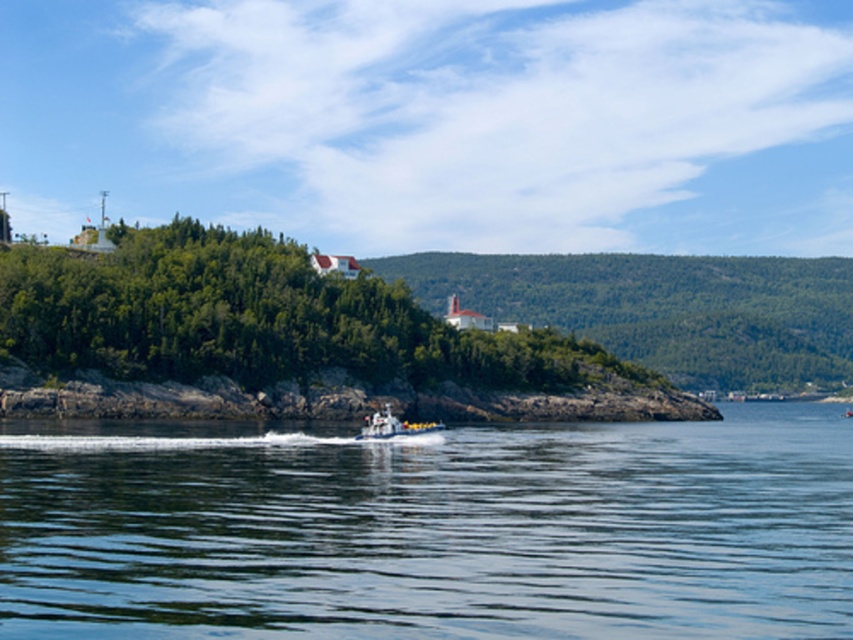
Question: Observing the image, what is the correct spatial positioning of clear blue water at center in reference to metallic gray boat at center?

Choices:
 (A) below
 (B) above

Answer: (A)

Question: Which point is closer to the camera?

Choices:
 (A) metallic gray boat at center
 (B) clear blue water at center

Answer: (B)

Question: Considering the relative positions of clear blue water at center and metallic gray boat at center in the image provided, where is clear blue water at center located with respect to metallic gray boat at center?

Choices:
 (A) left
 (B) right

Answer: (B)

Question: Can you confirm if clear blue water at center is thinner than metallic gray boat at center?

Choices:
 (A) no
 (B) yes

Answer: (A)

Question: Which of the following is the closest to the observer?

Choices:
 (A) clear blue water at center
 (B) metallic gray boat at center

Answer: (A)